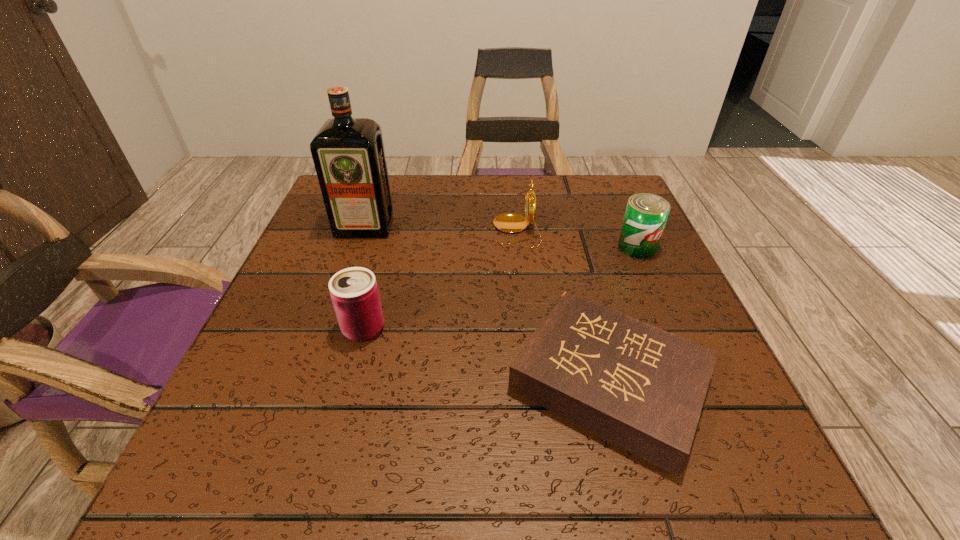
Image resolution: width=960 pixels, height=540 pixels. Identify the location of liquor. (348, 153).

Identify the location of pocket watch. (510, 223).

The width and height of the screenshot is (960, 540). Identify the location of the left can. (354, 292).

Locate an element on the screen. This screenshot has height=540, width=960. the farther can is located at coordinates (646, 214).

At what (x,y) coordinates should I click in order to perform the action: click on the shortest object. Please return your answer as a coordinate pair (x, y). This screenshot has height=540, width=960. Looking at the image, I should click on (642, 388).

Where is `vacant space situated on the front label of the liquor`? The width and height of the screenshot is (960, 540). vacant space situated on the front label of the liquor is located at coordinates (312, 380).

I want to click on blank area located on the face of the pocket watch, so click(x=396, y=231).

Locate an element on the screen. free location located 0.050m on the face of the pocket watch is located at coordinates (471, 231).

Identify the location of vacant space located 0.120m on the face of the pocket watch. click(440, 231).

You are a GUI agent. You are given a task and a screenshot of the screen. Output one action in this format:
    pyautogui.click(x=<x>, y=<y>)
    Task: Click on the vacant space located on the right of the left can
    
    Given the screenshot: What is the action you would take?
    pyautogui.click(x=558, y=328)